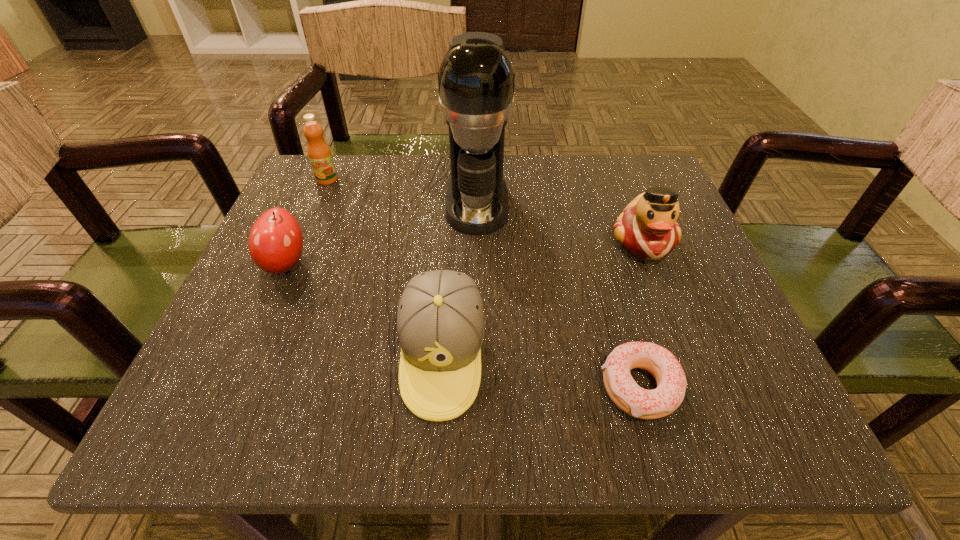
Where is `object that stands as the fourth closest to the orange juice`? This screenshot has height=540, width=960. object that stands as the fourth closest to the orange juice is located at coordinates (647, 229).

I want to click on free space in the image that satisfies the following two spatial constraints: 1. place cup under the spout of the shortest object; 2. on the right side of the tallest object, so click(476, 387).

Find the location of `free location that satisfies the following two spatial constraints: 1. on the front-facing side of the baseball cap; 2. on the right side of the shortest object`. free location that satisfies the following two spatial constraints: 1. on the front-facing side of the baseball cap; 2. on the right side of the shortest object is located at coordinates (441, 387).

Where is `free space in the image that satisfies the following two spatial constraints: 1. on the front side of the doughnut; 2. on the left side of the apple`? free space in the image that satisfies the following two spatial constraints: 1. on the front side of the doughnut; 2. on the left side of the apple is located at coordinates coord(232,387).